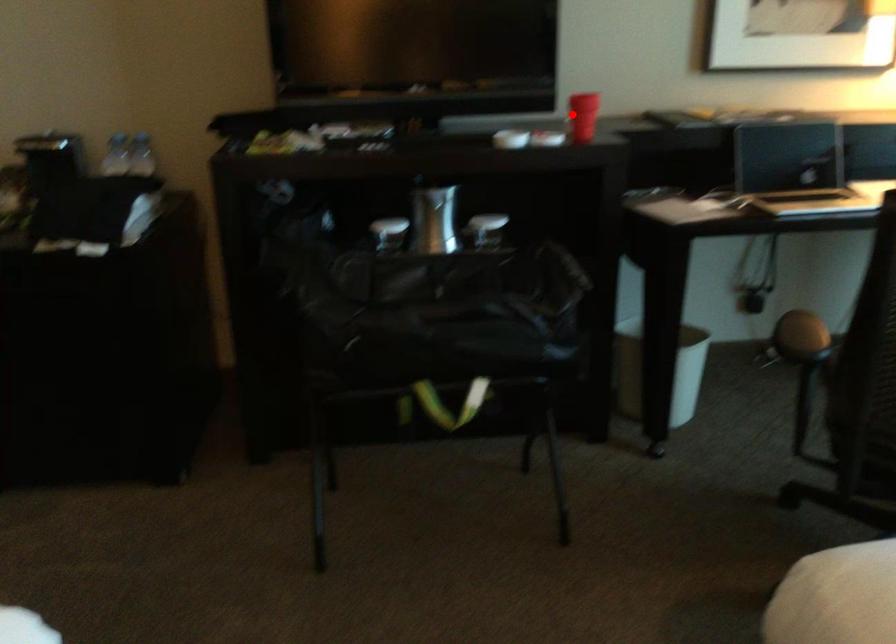
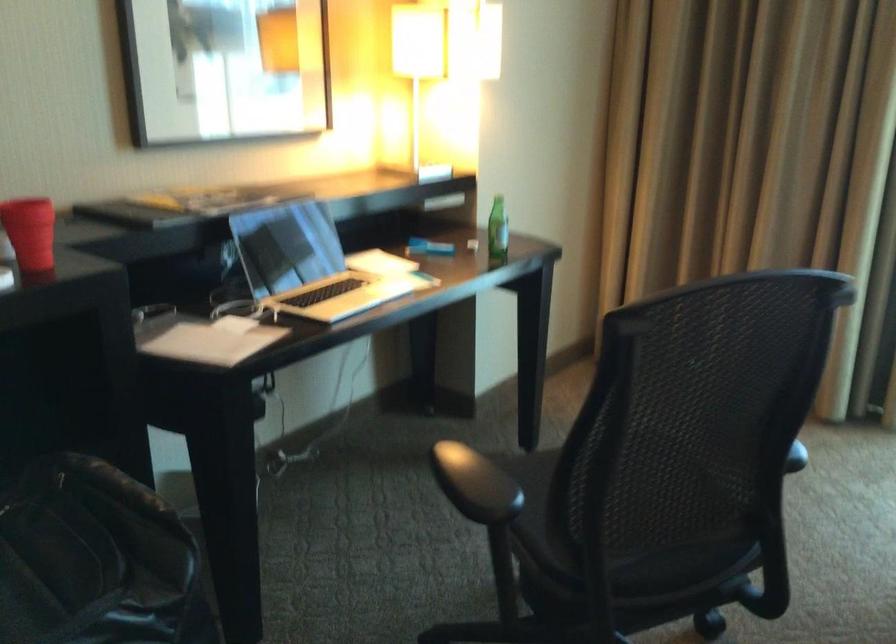
Question: I am providing you with two images of the same scene from different viewpoints. Given a red point in image1, look at the same physical point in image2. Is it:

Choices:
 (A) Closer to the viewpoint
 (B) Farther from the viewpoint

Answer: (A)